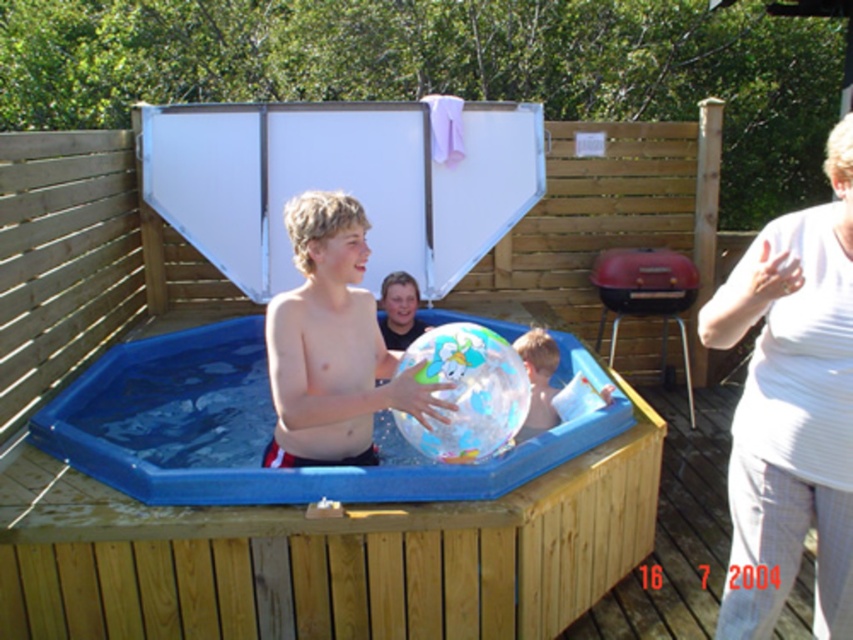
You are a lifeguard observing the transparent plastic pool at center and the smooth skin boy at center. Which object is closer to you?

The smooth skin boy at center is closer to you because the transparent plastic pool at center is positioned under him, meaning he is above the pool and thus nearer to your viewpoint.

You are a parent supervising the pool area. You notice the transparent plastic beach ball at center and the transparent plastic pool at center. Which object is closer to you?

The transparent plastic pool at center is closer to you because the transparent plastic beach ball at center is behind it.